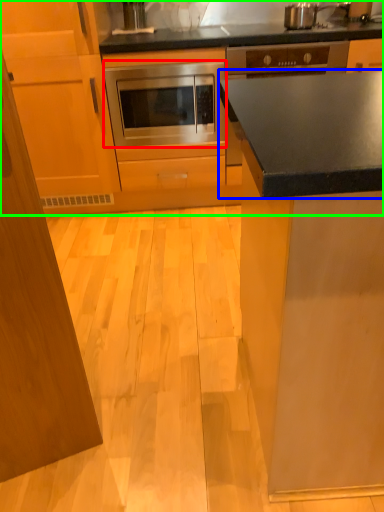
Question: Which object is positioned closest to oven (highlighted by a red box)? Select from countertop (highlighted by a blue box) and cabinetry (highlighted by a green box).

Choices:
 (A) countertop
 (B) cabinetry

Answer: (B)